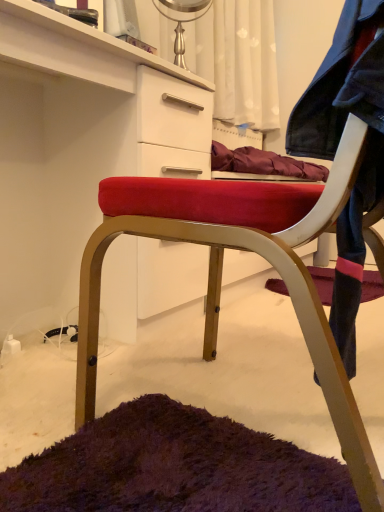
Image resolution: width=384 pixels, height=512 pixels. What do you see at coordinates (79, 146) in the screenshot?
I see `velvet red chair at center` at bounding box center [79, 146].

Identify the location of velvet red chair at center. This screenshot has width=384, height=512. (221, 276).

This screenshot has height=512, width=384. What do you see at coordinates (338, 143) in the screenshot?
I see `faded denim jacket at lower right` at bounding box center [338, 143].

The width and height of the screenshot is (384, 512). What are the coordinates of `faded denim jacket at lower right` in the screenshot? It's located at (338, 143).

Where is `velvet red chair at center`? velvet red chair at center is located at coordinates 79,146.

Can you confirm if velvet red chair at center is bigger than faded denim jacket at lower right?

Indeed, velvet red chair at center has a larger size compared to faded denim jacket at lower right.

Between velvet red chair at center and faded denim jacket at lower right, which one is positioned in front?

Positioned in front is faded denim jacket at lower right.

Is point (268, 206) farther from viewer compared to point (340, 61)?

Yes, it is behind point (340, 61).

Is velvet red chair at center far from faded denim jacket at lower right?

velvet red chair at center is actually quite close to faded denim jacket at lower right.

Who is shorter, velvet red chair at center or velvet red chair at center?

With less height is velvet red chair at center.

Locate an element on the screen. The height and width of the screenshot is (512, 384). chair on the right of velvet red chair at center is located at coordinates (221, 276).

Is velvet red chair at center smaller than velvet red chair at center?

Incorrect, velvet red chair at center is not smaller in size than velvet red chair at center.

How distant is velvet red chair at center from velvet red chair at center?

velvet red chair at center and velvet red chair at center are 22.44 inches apart from each other.

From a real-world perspective, is velvet red chair at center positioned under faded denim jacket at lower right based on gravity?

Yes, from a real-world perspective, velvet red chair at center is below faded denim jacket at lower right.

Which object is more forward, velvet red chair at center or faded denim jacket at lower right?

faded denim jacket at lower right is more forward.

From the picture: Is velvet red chair at center aimed at faded denim jacket at lower right?

Yes, velvet red chair at center faces towards faded denim jacket at lower right.

Considering the points (340, 202) and (71, 42), which point is in front, point (340, 202) or point (71, 42)?

Positioned in front is point (340, 202).

Is velvet red chair at center next to velvet red chair at center and touching it?

velvet red chair at center and velvet red chair at center are clearly separated.

Looking at this image, is velvet red chair at center behind velvet red chair at center?

No, it is in front of velvet red chair at center.

Is velvet red chair at center at the right side of velvet red chair at center?

Correct, you'll find velvet red chair at center to the right of velvet red chair at center.

Find the location of a particular element. The height and width of the screenshot is (512, 384). cabinetry above the faded denim jacket at lower right (from the image's perspective) is located at coordinates (79, 146).

Is faded denim jacket at lower right facing towards velvet red chair at center?

Yes, faded denim jacket at lower right is facing velvet red chair at center.

From a real-world perspective, between faded denim jacket at lower right and velvet red chair at center, who is vertically lower?

In real-world perspective, velvet red chair at center is lower.

Which is farther, (335, 140) or (18, 170)?

Point (18, 170)

Considering the sizes of objects faded denim jacket at lower right and velvet red chair at center in the image provided, who is taller, faded denim jacket at lower right or velvet red chair at center?

velvet red chair at center.

Considering the sizes of faded denim jacket at lower right and velvet red chair at center in the image, is faded denim jacket at lower right bigger or smaller than velvet red chair at center?

faded denim jacket at lower right is smaller than velvet red chair at center.

How much distance is there between faded denim jacket at lower right and velvet red chair at center?

13.36 centimeters.

Looking at this image, does faded denim jacket at lower right turn towards velvet red chair at center?

Yes, faded denim jacket at lower right is aimed at velvet red chair at center.

Identify the location of denim jacket lying on the right of velvet red chair at center. (338, 143).

In order to click on cabinetry behind the velvet red chair at center in this screenshot , I will do `click(79, 146)`.

Considering their positions, is velvet red chair at center positioned further to faded denim jacket at lower right than velvet red chair at center?

The object further to faded denim jacket at lower right is velvet red chair at center.

From the image, which object appears to be farther from velvet red chair at center, velvet red chair at center or faded denim jacket at lower right?

The object further to velvet red chair at center is faded denim jacket at lower right.

Considering their positions, is faded denim jacket at lower right positioned further to velvet red chair at center than velvet red chair at center?

The object further to velvet red chair at center is faded denim jacket at lower right.

Which object lies further to the anchor point velvet red chair at center, velvet red chair at center or faded denim jacket at lower right?

velvet red chair at center.

From the image, which object appears to be farther from faded denim jacket at lower right, velvet red chair at center or velvet red chair at center?

Based on the image, velvet red chair at center appears to be further to faded denim jacket at lower right.

Estimate the real-world distances between objects in this image. Which object is further from velvet red chair at center, faded denim jacket at lower right or velvet red chair at center?

Based on the image, velvet red chair at center appears to be further to velvet red chair at center.

You are a GUI agent. You are given a task and a screenshot of the screen. Output one action in this format:
    pyautogui.click(x=<x>, y=<y>)
    Task: Click on the chair situated between velvet red chair at center and faded denim jacket at lower right from left to right
    The height and width of the screenshot is (512, 384).
    Given the screenshot: What is the action you would take?
    [221, 276]